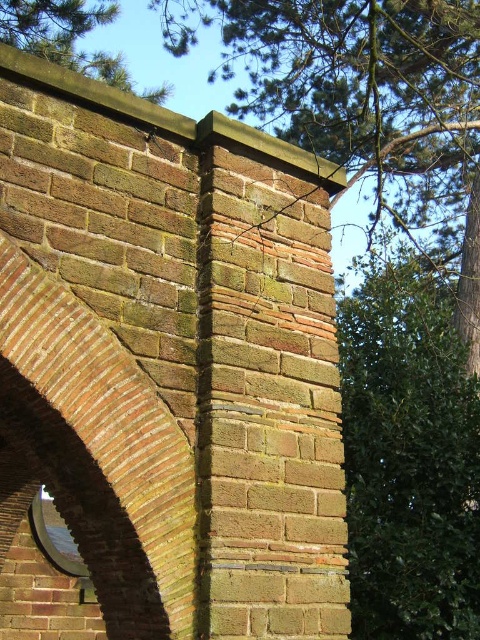
Based on the photo, can you confirm if green leafy tree at upper right is taller than green leafy tree at upper left?

Yes, green leafy tree at upper right is taller than green leafy tree at upper left.

The image size is (480, 640). Describe the element at coordinates (408, 452) in the screenshot. I see `green leafy tree at upper right` at that location.

Where is `green leafy tree at upper right`? green leafy tree at upper right is located at coordinates pos(408,452).

Image resolution: width=480 pixels, height=640 pixels. I want to click on green leafy tree at upper right, so click(408, 452).

Is rustic brick archway at left above green leafy tree at upper left?

No.

Can you confirm if rustic brick archway at left is positioned to the left of green leafy tree at upper left?

Incorrect, rustic brick archway at left is not on the left side of green leafy tree at upper left.

Is point (26, 282) farther from viewer compared to point (123, 68)?

No, (26, 282) is closer to viewer.

Locate an element on the screen. The height and width of the screenshot is (640, 480). rustic brick archway at left is located at coordinates (95, 452).

Consider the image. Is green leafy tree at upper center above green leafy tree at upper right?

Answer: Yes, green leafy tree at upper center is above green leafy tree at upper right.

Looking at this image, between green leafy tree at upper center and green leafy tree at upper right, which one appears on the left side from the viewer's perspective?

Positioned to the left is green leafy tree at upper right.

Who is more distant from viewer, (289, 138) or (355, 528)?

Point (289, 138)

Identify the location of green leafy tree at upper center. The image size is (480, 640). (365, 99).